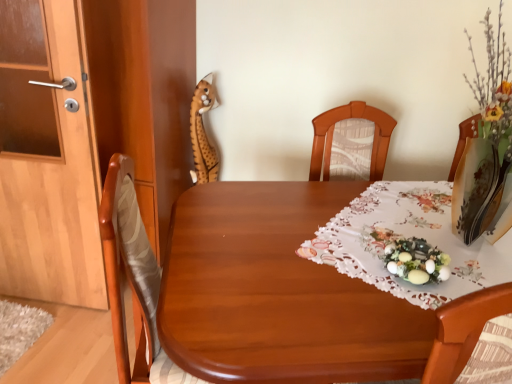
Question: Does wooden table at center appear on the right side of pastel floral wreath at center?

Choices:
 (A) no
 (B) yes

Answer: (B)

Question: Is wooden table at center with pastel floral wreath at center?

Choices:
 (A) no
 (B) yes

Answer: (A)

Question: Is wooden table at center at the left side of pastel floral wreath at center?

Choices:
 (A) yes
 (B) no

Answer: (B)

Question: Does wooden table at center have a greater height compared to pastel floral wreath at center?

Choices:
 (A) yes
 (B) no

Answer: (A)

Question: Is wooden table at center further to the viewer compared to pastel floral wreath at center?

Choices:
 (A) yes
 (B) no

Answer: (B)

Question: From a real-world perspective, is wooden table at center below pastel floral wreath at center?

Choices:
 (A) yes
 (B) no

Answer: (A)

Question: Is wooden door at left looking in the opposite direction of white lace tablecloth at center?

Choices:
 (A) no
 (B) yes

Answer: (A)

Question: Considering the relative sizes of wooden door at left and white lace tablecloth at center in the image provided, is wooden door at left thinner than white lace tablecloth at center?

Choices:
 (A) no
 (B) yes

Answer: (B)

Question: Is wooden door at left taller than white lace tablecloth at center?

Choices:
 (A) no
 (B) yes

Answer: (B)

Question: Considering the relative positions of wooden door at left and white lace tablecloth at center in the image provided, is wooden door at left to the left of white lace tablecloth at center from the viewer's perspective?

Choices:
 (A) no
 (B) yes

Answer: (B)

Question: Can you confirm if wooden door at left is bigger than white lace tablecloth at center?

Choices:
 (A) no
 (B) yes

Answer: (A)

Question: Is wooden door at left far from white lace tablecloth at center?

Choices:
 (A) no
 (B) yes

Answer: (B)

Question: Is wooden door at left surrounded by white lace tablecloth at center?

Choices:
 (A) yes
 (B) no

Answer: (B)